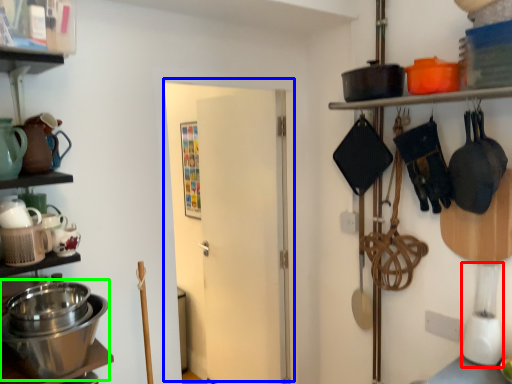
Question: Which object is positioned closest to blender (highlighted by a red box)? Select from door (highlighted by a blue box) and appliance (highlighted by a green box).

Choices:
 (A) door
 (B) appliance

Answer: (B)